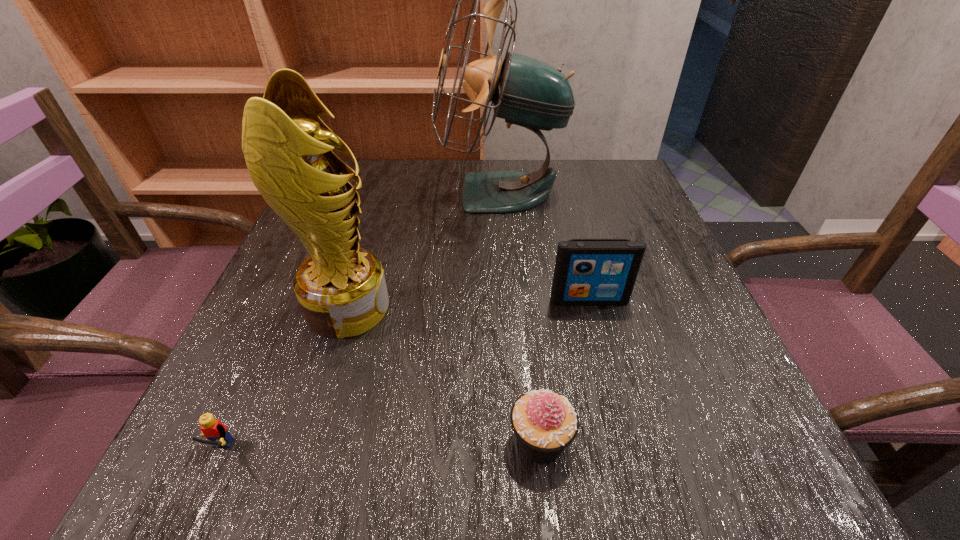
Where is `free space between the third tallest object and the fan`? free space between the third tallest object and the fan is located at coordinates (544, 247).

This screenshot has width=960, height=540. In order to click on unoccupied position between the third shortest object and the second shortest object in this screenshot , I will do `click(564, 370)`.

Find the location of a particular element. The width and height of the screenshot is (960, 540). free space between the iPod and the leftmost object is located at coordinates (404, 378).

Locate an element on the screen. free space between the shortest object and the third tallest object is located at coordinates (404, 378).

Identify which object is the second nearest to the iPod. Please provide its 2D coordinates. Your answer should be formatted as a tuple, i.e. [(x, y)], where the tuple contains the x and y coordinates of a point satisfying the conditions above.

[(544, 422)]

The height and width of the screenshot is (540, 960). I want to click on object that ranks as the second closest to the cupcake, so click(341, 288).

You are a GUI agent. You are given a task and a screenshot of the screen. Output one action in this format:
    pyautogui.click(x=<x>, y=<y>)
    Task: Click on the free spot that satisfies the following two spatial constraints: 1. on the front-facing side of the fan for air flow; 2. on the front-facing side of the Lego
    
    Given the screenshot: What is the action you would take?
    coord(516,456)

Identify the location of free point that satisfies the following two spatial constraints: 1. on the front-facing side of the farthest object for air flow; 2. on the left side of the second shortest object. (516, 441).

Where is `vacant region that satisfies the following two spatial constraints: 1. on the front-facing side of the award; 2. on the front-facing side of the shortest object`? This screenshot has height=540, width=960. vacant region that satisfies the following two spatial constraints: 1. on the front-facing side of the award; 2. on the front-facing side of the shortest object is located at coordinates (302, 456).

Find the location of `free spot that satisfies the following two spatial constraints: 1. on the front-facing side of the fan for air flow; 2. on the front-facing side of the leftmost object`. free spot that satisfies the following two spatial constraints: 1. on the front-facing side of the fan for air flow; 2. on the front-facing side of the leftmost object is located at coordinates (516, 456).